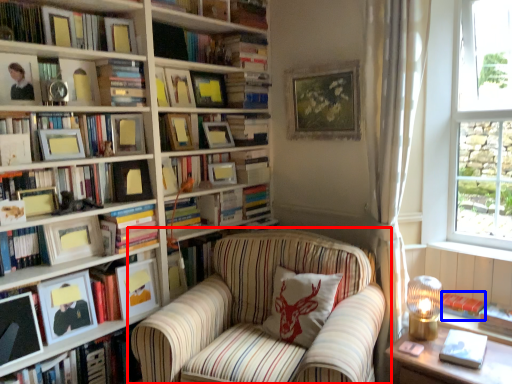
Question: Which of the following is the farthest to the observer, chair (highlighted by a red box) or book (highlighted by a blue box)?

Choices:
 (A) chair
 (B) book

Answer: (B)